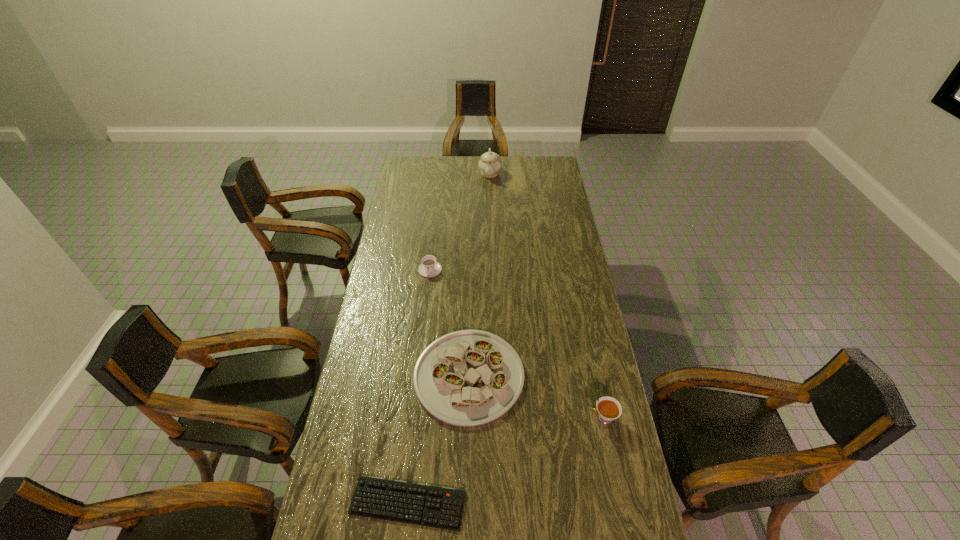
Image resolution: width=960 pixels, height=540 pixels. Find the location of `vacant region at the left edge of the desktop`. vacant region at the left edge of the desktop is located at coordinates (363, 399).

Identify the location of vacant area at the right edge. The width and height of the screenshot is (960, 540). (599, 448).

The image size is (960, 540). Find the location of `blank space at the far left corner of the desktop`. blank space at the far left corner of the desktop is located at coordinates (410, 166).

Where is `unoccupied position between the chinaware and the platter`? The height and width of the screenshot is (540, 960). unoccupied position between the chinaware and the platter is located at coordinates (479, 274).

The height and width of the screenshot is (540, 960). Identify the location of free point between the chinaware and the taller teacup. (546, 295).

This screenshot has width=960, height=540. Find the location of `free space between the nearer teacup and the nearest object`. free space between the nearer teacup and the nearest object is located at coordinates (506, 461).

This screenshot has width=960, height=540. Identify the location of vacant area between the fourth tallest object and the platter. (449, 323).

Where is `free spot between the shorter teacup and the tallest object`? This screenshot has height=540, width=960. free spot between the shorter teacup and the tallest object is located at coordinates (460, 221).

Where is `vacant space that's between the rightmost object and the chinaware`? The width and height of the screenshot is (960, 540). vacant space that's between the rightmost object and the chinaware is located at coordinates (546, 295).

Select which object appears as the fourth closest to the platter. Please provide its 2D coordinates. Your answer should be formatted as a tuple, i.e. [(x, y)], where the tuple contains the x and y coordinates of a point satisfying the conditions above.

[(489, 164)]